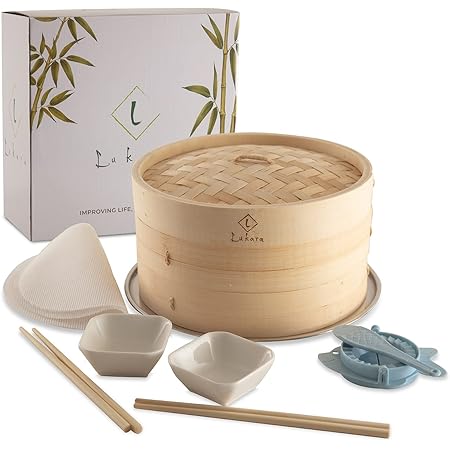
The height and width of the screenshot is (450, 450). I want to click on steamer basket lid, so click(x=246, y=177).